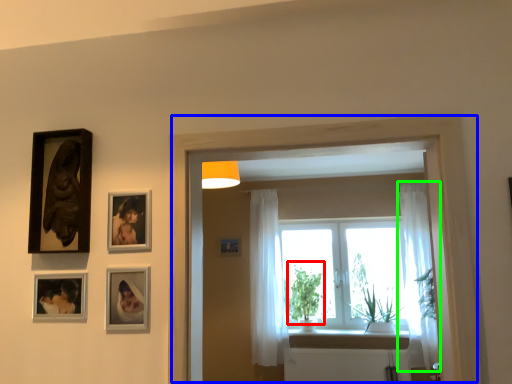
Question: Which object is positioned closest to plant (highlighted by a red box)? Select from window frame (highlighted by a blue box) and curtain (highlighted by a green box).

Choices:
 (A) window frame
 (B) curtain

Answer: (B)